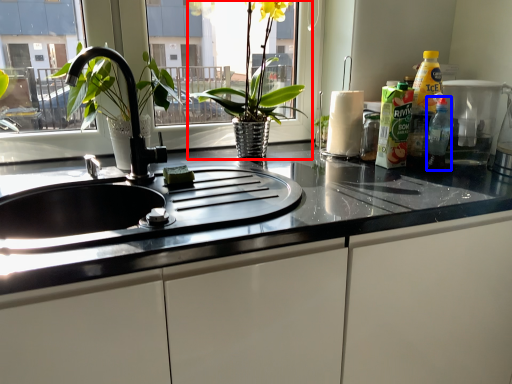
Question: Which of the following is the closest to the observer, houseplant (highlighted by a red box) or bottle (highlighted by a blue box)?

Choices:
 (A) houseplant
 (B) bottle

Answer: (A)